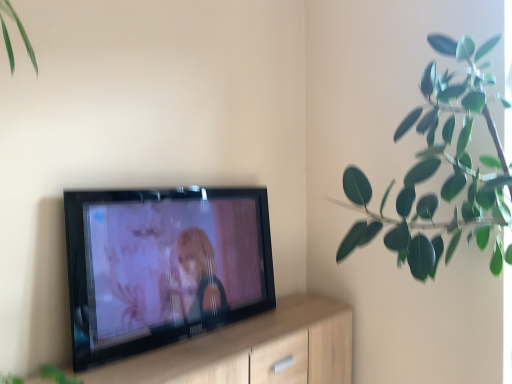
Question: Is green rubber plant at upper right further to camera compared to light wood dresser at center?

Choices:
 (A) no
 (B) yes

Answer: (B)

Question: Is green rubber plant at upper right wider than light wood dresser at center?

Choices:
 (A) no
 (B) yes

Answer: (B)

Question: Is green rubber plant at upper right outside of light wood dresser at center?

Choices:
 (A) no
 (B) yes

Answer: (B)

Question: Is green rubber plant at upper right to the right of light wood dresser at center from the viewer's perspective?

Choices:
 (A) yes
 (B) no

Answer: (A)

Question: From a real-world perspective, is green rubber plant at upper right located beneath light wood dresser at center?

Choices:
 (A) yes
 (B) no

Answer: (B)

Question: Does green rubber plant at upper right have a lesser width compared to light wood dresser at center?

Choices:
 (A) yes
 (B) no

Answer: (B)

Question: Is light wood dresser at center taller than green rubber plant at upper right?

Choices:
 (A) yes
 (B) no

Answer: (B)

Question: Can you confirm if light wood dresser at center is bigger than green rubber plant at upper right?

Choices:
 (A) yes
 (B) no

Answer: (B)

Question: From the image's perspective, would you say light wood dresser at center is positioned over green rubber plant at upper right?

Choices:
 (A) yes
 (B) no

Answer: (B)

Question: Is light wood dresser at center to the left of green rubber plant at upper right from the viewer's perspective?

Choices:
 (A) yes
 (B) no

Answer: (A)

Question: From a real-world perspective, does light wood dresser at center stand above green rubber plant at upper right?

Choices:
 (A) no
 (B) yes

Answer: (A)

Question: Are light wood dresser at center and green rubber plant at upper right located far from each other?

Choices:
 (A) no
 (B) yes

Answer: (A)

Question: Based on their positions, is green rubber plant at upper right located to the left or right of light wood dresser at center?

Choices:
 (A) left
 (B) right

Answer: (B)